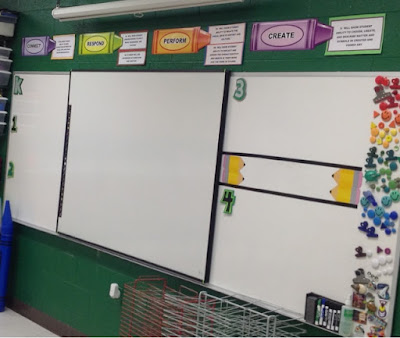
Identify the location of racks. Image resolution: width=400 pixels, height=338 pixels. (159, 306), (151, 319), (140, 327), (220, 313), (211, 327).